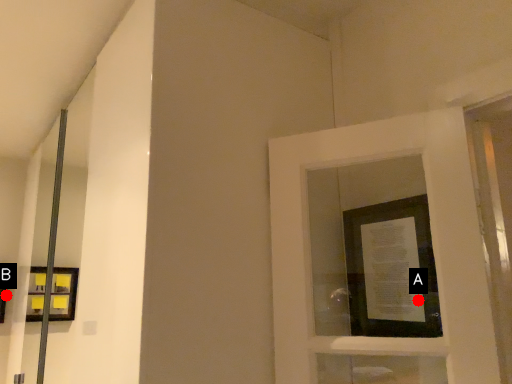
Question: Two points are circled on the image, labeled by A and B beside each circle. Which point is closer to the camera taking this photo?

Choices:
 (A) A is closer
 (B) B is closer

Answer: (A)